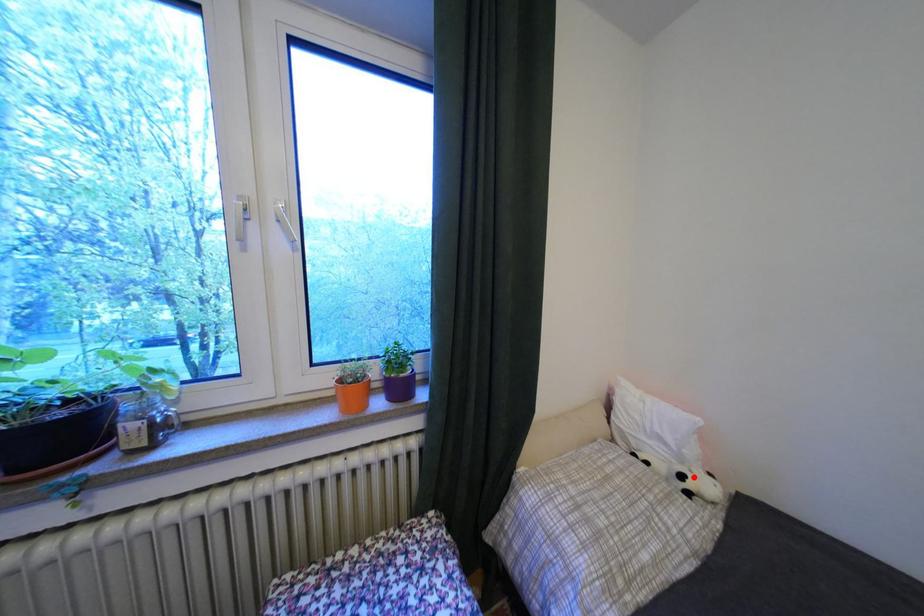
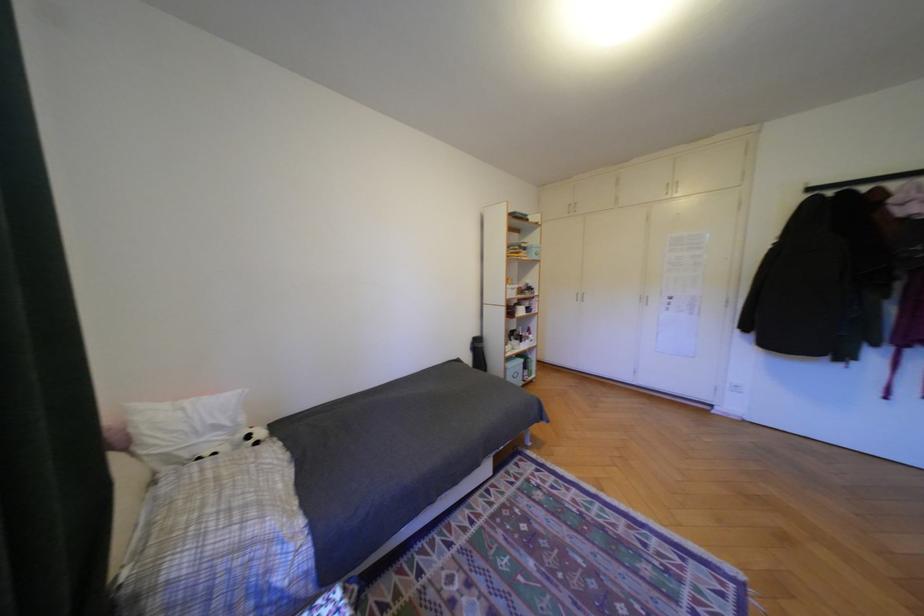
The point at the highlighted location is marked in the first image. Where is the corresponding point in the second image?

(261, 437)